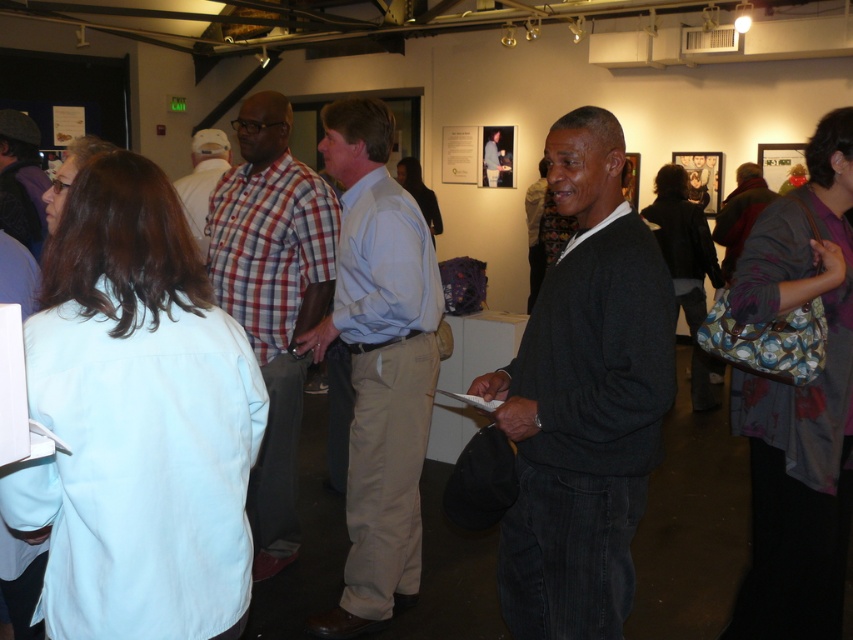
Which is above, plaid fabric shirt at center or matte black sweater at center?

matte black sweater at center is higher up.

Image resolution: width=853 pixels, height=640 pixels. What are the coordinates of `plaid fabric shirt at center` in the screenshot? It's located at (202, 179).

What do you see at coordinates (202, 179) in the screenshot?
I see `plaid fabric shirt at center` at bounding box center [202, 179].

Where is `plaid fabric shirt at center`? plaid fabric shirt at center is located at coordinates (202, 179).

Can you confirm if checkered fabric shirt at center is positioned above plaid fabric shirt at center?

Incorrect, checkered fabric shirt at center is not positioned above plaid fabric shirt at center.

Which of these two, checkered fabric shirt at center or plaid fabric shirt at center, stands shorter?

With less height is plaid fabric shirt at center.

Between point (296, 260) and point (202, 179), which one is positioned behind?

Positioned behind is point (202, 179).

Locate an element on the screen. This screenshot has width=853, height=640. checkered fabric shirt at center is located at coordinates (271, 298).

Who is lower down, dark gray sweater at center or light blue shirt at center?

dark gray sweater at center

Is dark gray sweater at center below light blue shirt at center?

Yes, dark gray sweater at center is below light blue shirt at center.

Between point (532, 394) and point (392, 348), which one is positioned behind?

Point (392, 348)

Find the location of a particular element. dark gray sweater at center is located at coordinates (584, 397).